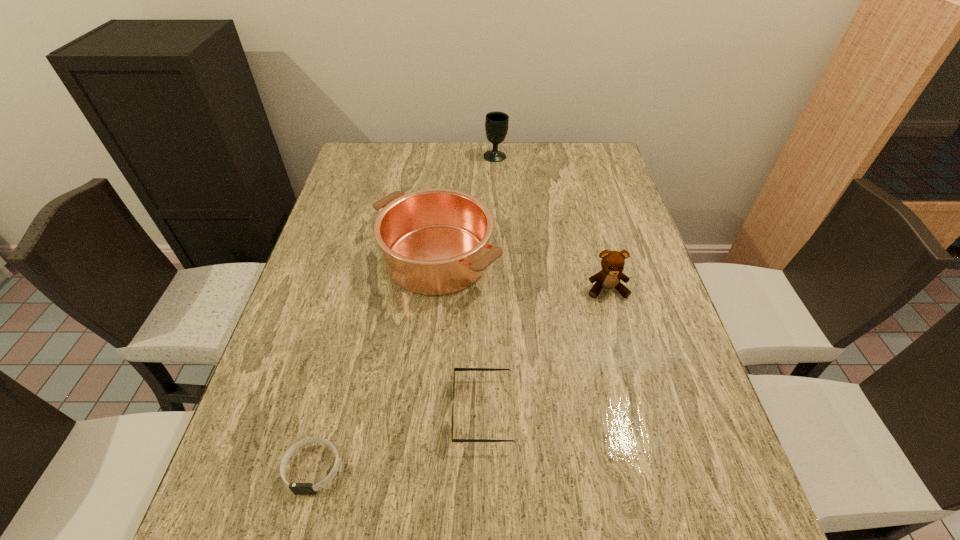
Find the location of `vacant space situated on the front-facing side of the fourth tallest object`. vacant space situated on the front-facing side of the fourth tallest object is located at coordinates (413, 411).

Image resolution: width=960 pixels, height=540 pixels. In order to click on object located at the far edge in this screenshot , I will do `click(496, 123)`.

You are a GUI agent. You are given a task and a screenshot of the screen. Output one action in this format:
    pyautogui.click(x=<x>, y=<y>)
    Task: Click on the object located in the left edge section of the desktop
    The height and width of the screenshot is (540, 960).
    Given the screenshot: What is the action you would take?
    pyautogui.click(x=297, y=488)

The width and height of the screenshot is (960, 540). I want to click on object that is at the right edge, so click(x=612, y=262).

The height and width of the screenshot is (540, 960). I want to click on blank area at the far edge, so click(x=454, y=167).

Image resolution: width=960 pixels, height=540 pixels. Find the location of `vacant region at the left edge of the desktop`. vacant region at the left edge of the desktop is located at coordinates (373, 185).

Identify the location of vacant region at the right edge of the desktop. The height and width of the screenshot is (540, 960). (585, 234).

This screenshot has width=960, height=540. Find the location of `vacant space at the far right corner of the desktop`. vacant space at the far right corner of the desktop is located at coordinates click(x=588, y=159).

Image resolution: width=960 pixels, height=540 pixels. I want to click on vacant region between the saucepan and the teddy bear, so click(522, 274).

Where is `free spot between the saucepan and the shortest object`? free spot between the saucepan and the shortest object is located at coordinates (375, 363).